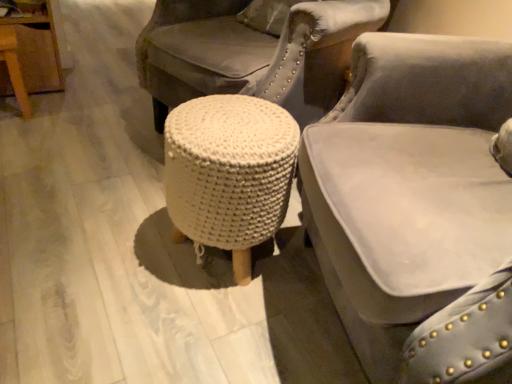
Question: Based on their sizes in the image, would you say velvet gray chair at center is bigger or smaller than white knitted stool at center?

Choices:
 (A) big
 (B) small

Answer: (A)

Question: Considering the positions of velvet gray chair at center and white knitted stool at center in the image, is velvet gray chair at center taller or shorter than white knitted stool at center?

Choices:
 (A) tall
 (B) short

Answer: (A)

Question: Visually, is velvet gray chair at center positioned to the left or to the right of white knitted stool at center?

Choices:
 (A) right
 (B) left

Answer: (A)

Question: Considering their positions, is white knitted stool at center located in front of or behind velvet gray chair at center?

Choices:
 (A) front
 (B) behind

Answer: (B)

Question: From a real-world perspective, is white knitted stool at center physically located above or below velvet gray chair at center?

Choices:
 (A) above
 (B) below

Answer: (B)

Question: Considering the relative positions of white knitted stool at center and velvet gray chair at center in the image provided, is white knitted stool at center to the left or to the right of velvet gray chair at center?

Choices:
 (A) right
 (B) left

Answer: (B)

Question: Is white knitted stool at center inside the boundaries of velvet gray chair at center, or outside?

Choices:
 (A) inside
 (B) outside

Answer: (B)